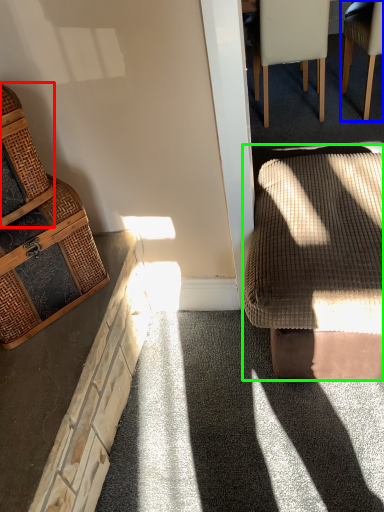
Question: Which object is the farthest from basket (highlighted by a red box)? Choose among these: chair (highlighted by a blue box) or rocking chair (highlighted by a green box).

Choices:
 (A) chair
 (B) rocking chair

Answer: (A)